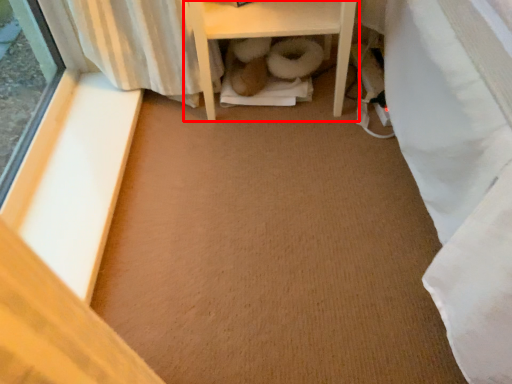
Question: From the image's perspective, where is furniture (annotated by the red box) located relative to window sill?

Choices:
 (A) below
 (B) above

Answer: (B)